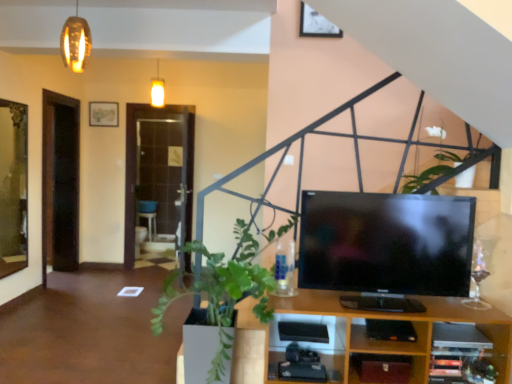
Question: Is white glossy flower at upper center spatially inside green leafy plant at lower left, or outside of it?

Choices:
 (A) outside
 (B) inside

Answer: (A)

Question: In the image, is white glossy flower at upper center on the left side or the right side of green leafy plant at lower left?

Choices:
 (A) left
 (B) right

Answer: (B)

Question: Based on their relative distances, which object is nearer to the metallic silver picture frame at upper center?

Choices:
 (A) green leafy plant at lower left
 (B) white glossy flower at upper center

Answer: (B)

Question: Which of these objects is positioned farthest from the green leafy plant at lower left?

Choices:
 (A) metallic silver picture frame at upper center
 (B) white glossy flower at upper center

Answer: (A)